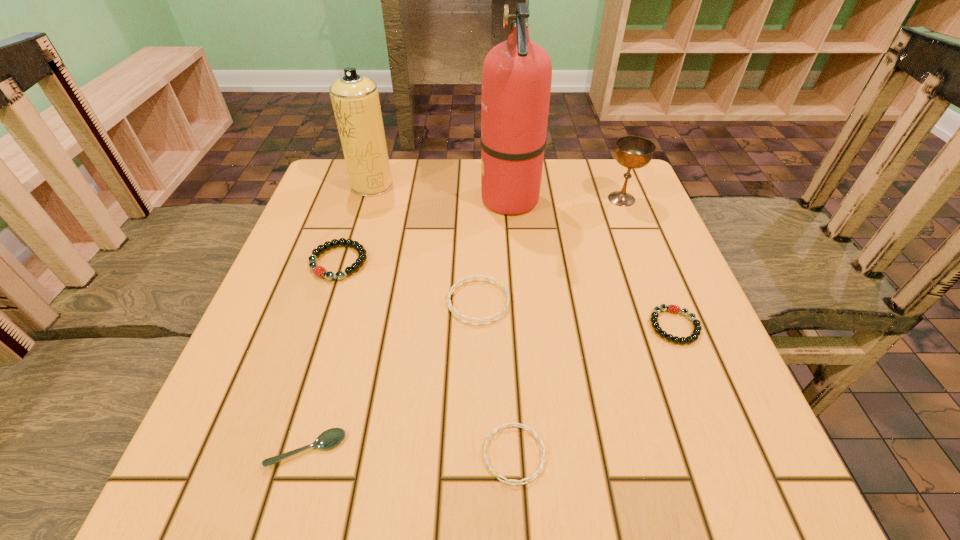
Where is `the tallest object`? This screenshot has height=540, width=960. the tallest object is located at coordinates (516, 79).

I want to click on red fire extinguisher, so click(x=516, y=79).

You are a GUI agent. You are given a task and a screenshot of the screen. Output one action in this format:
    pyautogui.click(x=<x>, y=<y>)
    Task: Click on the aerosol can
    
    Given the screenshot: What is the action you would take?
    pyautogui.click(x=355, y=99)

At what (x,y) coordinates should I click in order to perform the action: click on the third tallest object. Please return your answer as a coordinate pair (x, y). The width and height of the screenshot is (960, 540). Looking at the image, I should click on (633, 152).

This screenshot has width=960, height=540. Identify the location of the tallest bracelet. (319, 271).

At what (x,y) coordinates should I click in order to perform the action: click on the bigger black bracelet. Please return your answer as a coordinate pair (x, y). This screenshot has width=960, height=540. Looking at the image, I should click on (319, 271).

Locate an element on the screen. the farther blue bracelet is located at coordinates coord(454,286).

This screenshot has width=960, height=540. In order to click on the rightmost bracelet in this screenshot , I will do `click(696, 332)`.

You are a GUI agent. You are given a task and a screenshot of the screen. Output one action in this format:
    pyautogui.click(x=<x>, y=<y>)
    Task: Click on the smaller black bracelet
    The height and width of the screenshot is (540, 960).
    Given the screenshot: What is the action you would take?
    pyautogui.click(x=696, y=332)

You are a GUI agent. You are given a task and a screenshot of the screen. Output one action in this format:
    pyautogui.click(x=<x>, y=<y>)
    Task: Click on the soupspoon
    
    Given the screenshot: What is the action you would take?
    pyautogui.click(x=330, y=438)